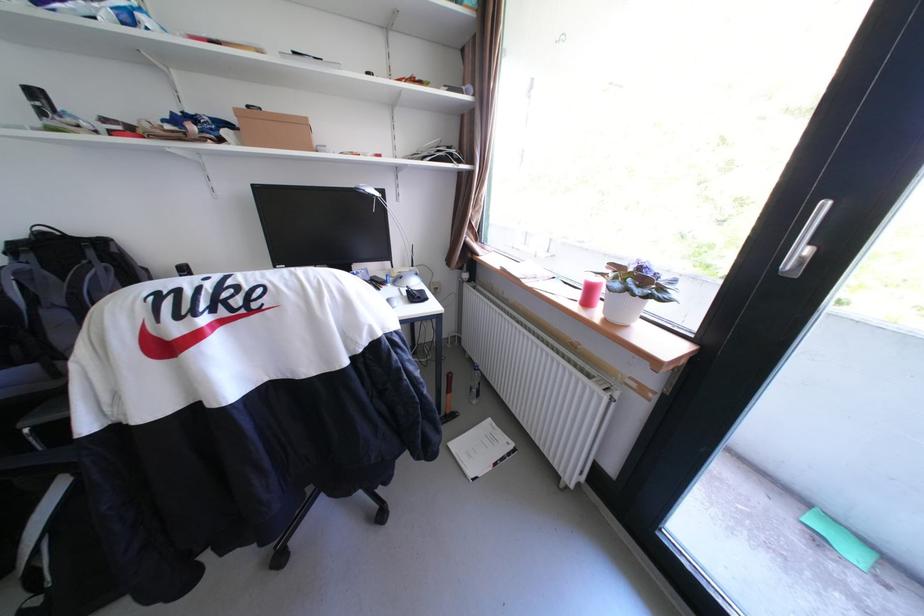
What do you see at coordinates (841, 539) in the screenshot? I see `a green sponge` at bounding box center [841, 539].